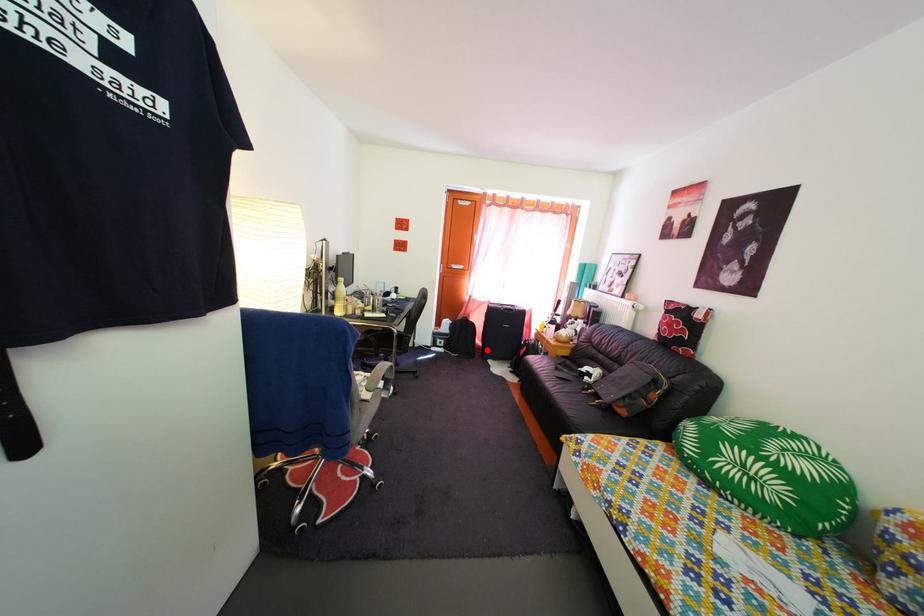
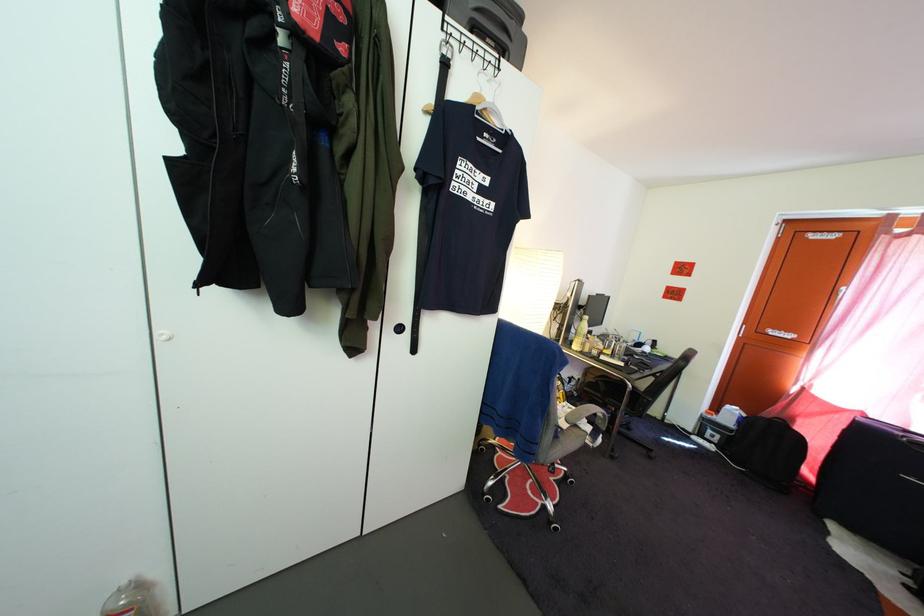
Question: I am providing you with two images of the same scene from different viewpoints. Image1 has a red point marked. In image2, the corresponding 3D location appears at what relative position? Reply with the corresponding letter.

Choices:
 (A) Closer
 (B) Farther

Answer: (B)